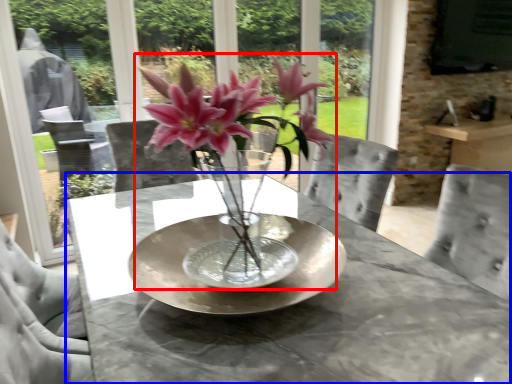
Question: Which object appears farthest to the camera in this image, houseplant (highlighted by a red box) or table (highlighted by a blue box)?

Choices:
 (A) houseplant
 (B) table

Answer: (B)